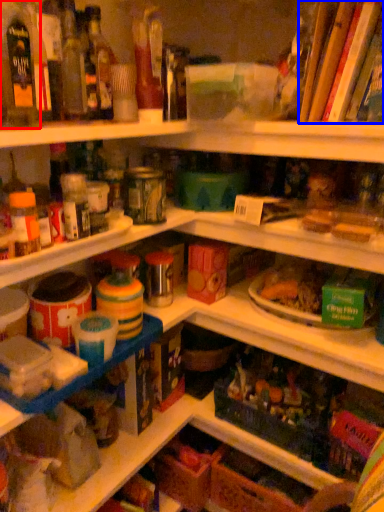
Question: Which point is further to the camera, bottle (highlighted by a red box) or book (highlighted by a blue box)?

Choices:
 (A) bottle
 (B) book

Answer: (B)